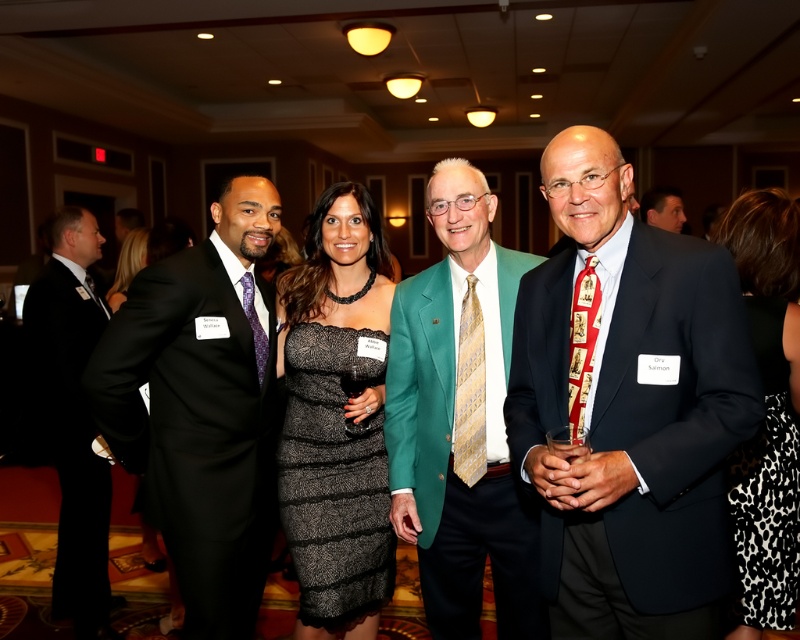
This screenshot has width=800, height=640. What do you see at coordinates (628, 406) in the screenshot? I see `matte black suit at right` at bounding box center [628, 406].

Is matte black suit at right to the right of black sequined dress at center from the viewer's perspective?

Indeed, matte black suit at right is positioned on the right side of black sequined dress at center.

Between point (632, 554) and point (326, 326), which one is positioned behind?

Point (326, 326)

Identify the location of matte black suit at right. Image resolution: width=800 pixels, height=640 pixels. (628, 406).

Measure the distance between matte black suit at left and black sequined dress at center.

They are 9.54 inches apart.

Is matte black suit at left above black sequined dress at center?

No.

Locate an element on the screen. matte black suit at left is located at coordinates (196, 429).

Can you confirm if matte black suit at right is smaller than green textured blazer at center?

Yes.

Between matte black suit at right and green textured blazer at center, which one has less height?

matte black suit at right

Where is `matte black suit at right`? The image size is (800, 640). matte black suit at right is located at coordinates (628, 406).